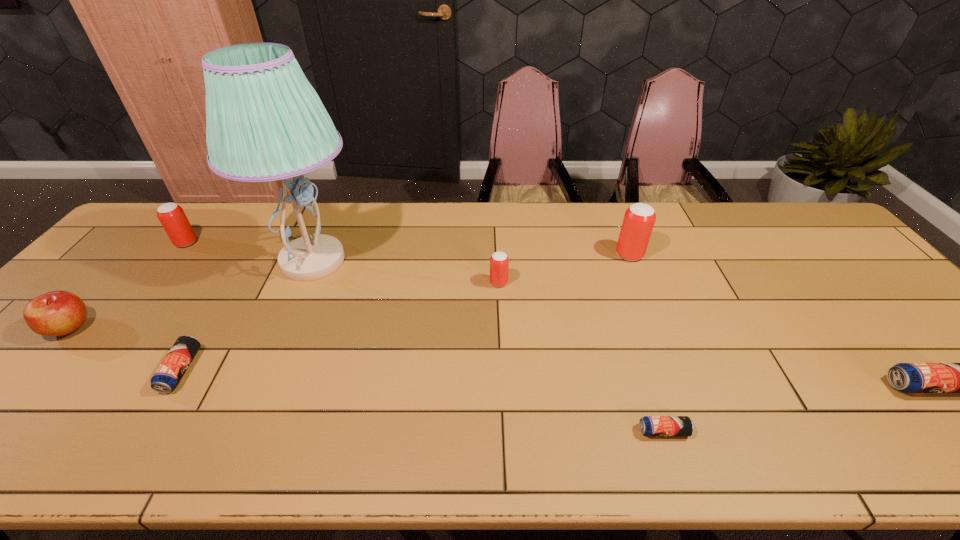
Select which red beer can is the closest to the third tallest object. Please provide its 2D coordinates. Your answer should be formatted as a tuple, i.e. [(x, y)], where the tuple contains the x and y coordinates of a point satisfying the conditions above.

[(499, 262)]

Where is `red beer can that stands as the second closest to the teal lamp`? The width and height of the screenshot is (960, 540). red beer can that stands as the second closest to the teal lamp is located at coordinates (499, 262).

Identify which blue beer can is the third nearest to the seventh object from right to left. Please provide its 2D coordinates. Your answer should be formatted as a tuple, i.e. [(x, y)], where the tuple contains the x and y coordinates of a point satisfying the conditions above.

[(906, 377)]

The image size is (960, 540). In order to click on the second closest blue beer can relative to the third shortest beer can in this screenshot , I will do `click(168, 375)`.

Locate an element on the screen. Image resolution: width=960 pixels, height=540 pixels. free point that satisfies the following two spatial constraints: 1. on the back side of the tallest beer can; 2. on the left side of the smallest blue beer can is located at coordinates (605, 255).

Image resolution: width=960 pixels, height=540 pixels. Identify the location of vacant position in the image that satisfies the following two spatial constraints: 1. on the back side of the fourth nearest beer can; 2. on the right side of the biggest red beer can. (497, 255).

I want to click on free space that satisfies the following two spatial constraints: 1. on the back side of the apple; 2. on the right side of the fifth object from right to left, so click(x=131, y=261).